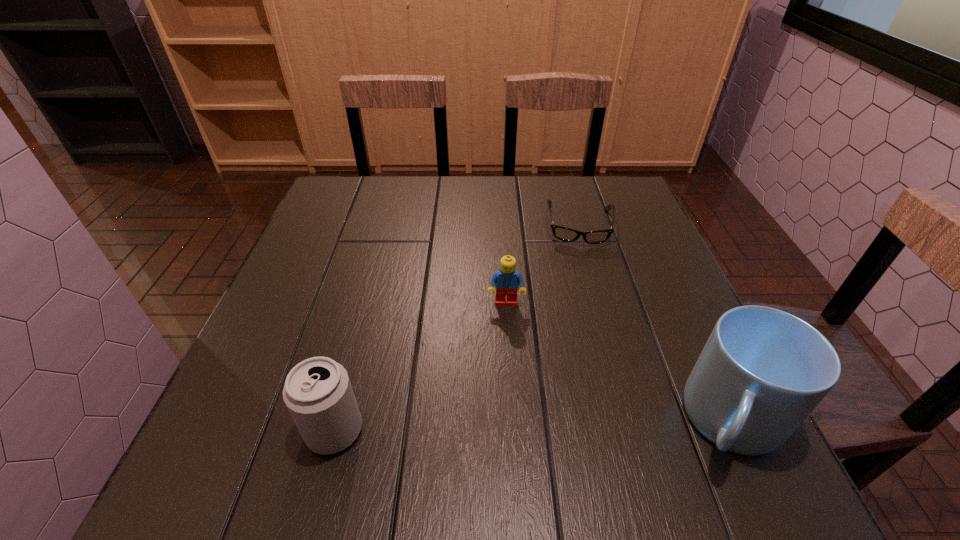
Where is `can`? can is located at coordinates [318, 394].

The height and width of the screenshot is (540, 960). Find the location of `the leftmost object`. the leftmost object is located at coordinates (318, 394).

This screenshot has width=960, height=540. I want to click on the tallest object, so click(x=762, y=371).

This screenshot has width=960, height=540. Identify the location of the third object from right to left. (506, 280).

Identify the location of Lego. (506, 280).

The height and width of the screenshot is (540, 960). Find the location of `the shortest object`. the shortest object is located at coordinates (562, 233).

What are the coordinates of `the farthest object` in the screenshot? It's located at (562, 233).

Identify the location of vacant space located on the back of the can. (370, 297).

Locate an element on the screen. The height and width of the screenshot is (540, 960). blank space located 0.070m on the left of the tallest object is located at coordinates (639, 421).

Image resolution: width=960 pixels, height=540 pixels. What are the coordinates of `blank space located on the face of the Lego` in the screenshot? It's located at (509, 410).